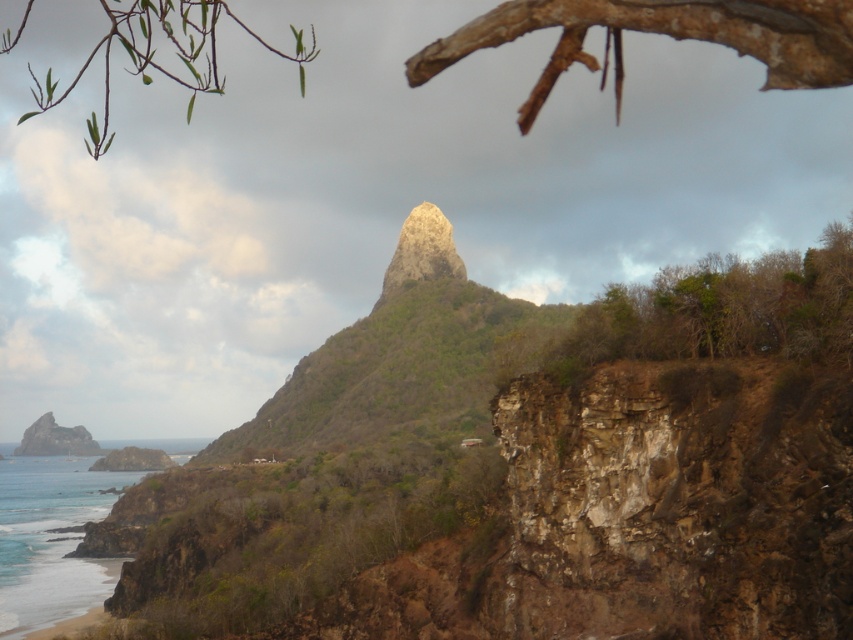
You are standing on the cliff and want to look at the blue water at lower left and the rusty metallic rock at lower left. Which one is closer to the bottom edge of the image?

The blue water at lower left is shorter than the rusty metallic rock at lower left, so the blue water at lower left is closer to the bottom edge of the image.

You are standing on the cliff and want to take a photo of the blue water at lower left and the rusty metallic rock at lower left. Which object will appear closer to the camera in your photo?

The blue water at lower left will appear closer to the camera in your photo because it is positioned in front of the rusty metallic rock at lower left.